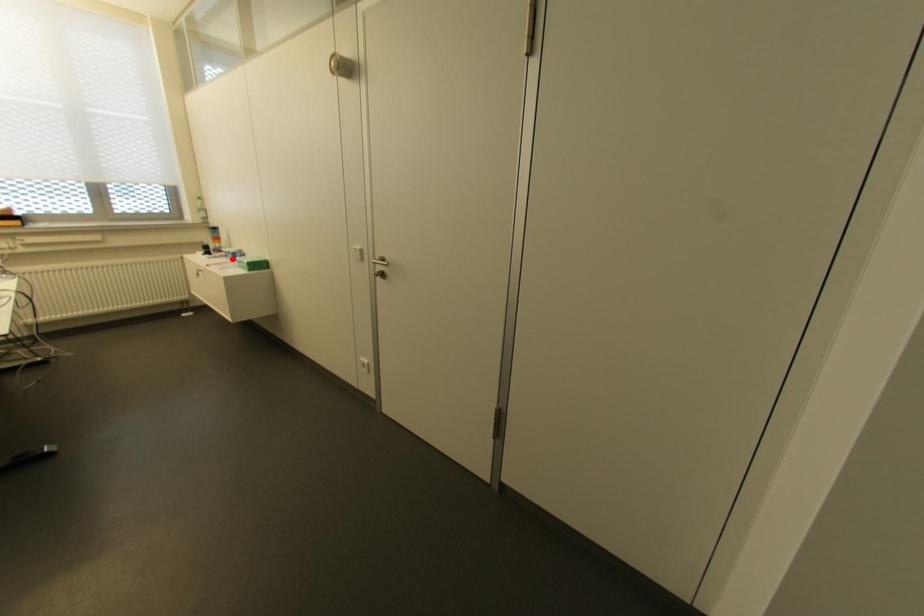
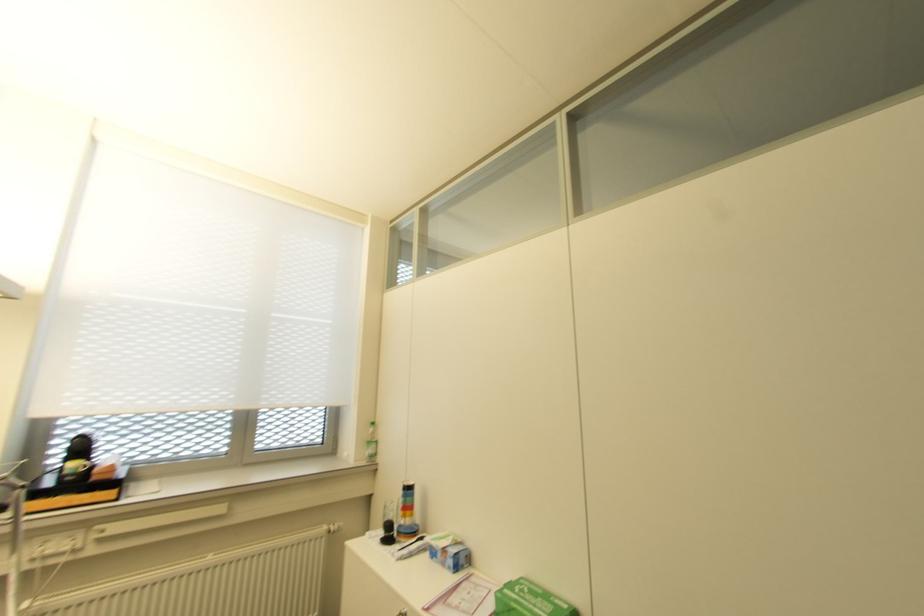
Locate, in the second image, the point that corresponds to the highlighted location in the first image.

(454, 568)